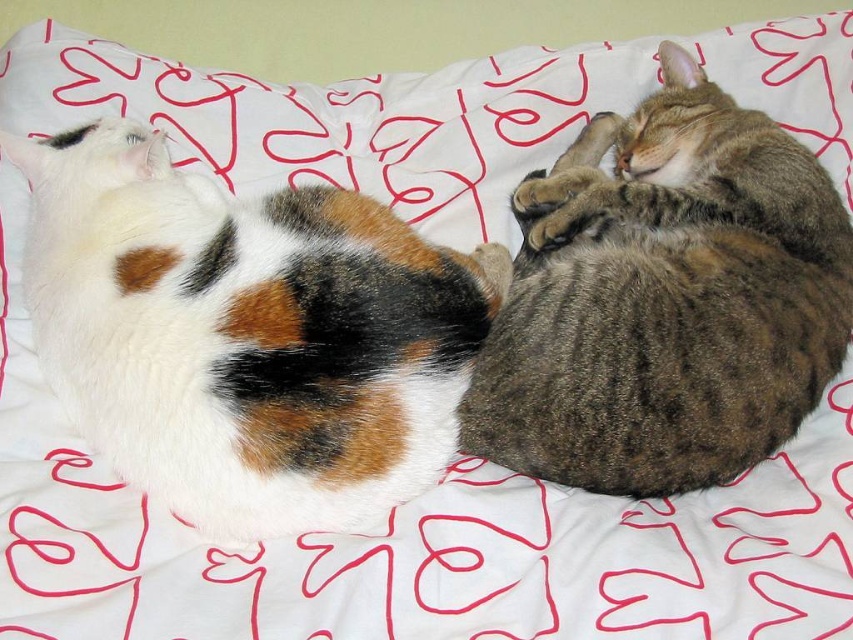
You are a veterinarian examining two cats in an image. You need to determine which cat requires a larger blanket based on their size. The cats are the white fluffy cat at left and the tabby fur cat at center. Which cat should get the bigger blanket?

The white fluffy cat at left is larger in size than the tabby fur cat at center, so it should receive the bigger blanket to accommodate its size.

You are holding a remote control that is 2 feet long. You want to place it on the white surface with red heart patterns so that it reaches from the camera to the point at point (260, 365). Will the remote control be long enough?

The distance between the camera and point (260, 365) is 4.04 feet, so the remote control that is 2 feet long will not be long enough to reach from the camera to the point (260, 365).